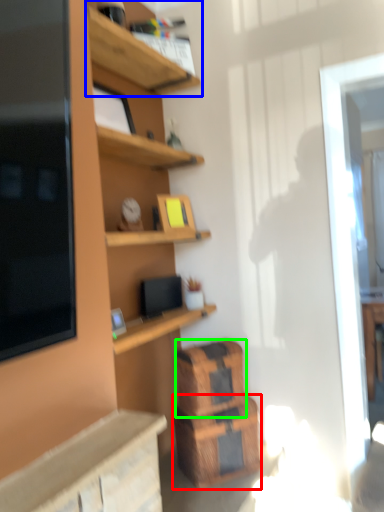
Question: Based on their relative distances, which object is nearer to crate (highlighted by a red box)? Choose from shelf (highlighted by a blue box) and crate (highlighted by a green box).

Choices:
 (A) shelf
 (B) crate

Answer: (B)